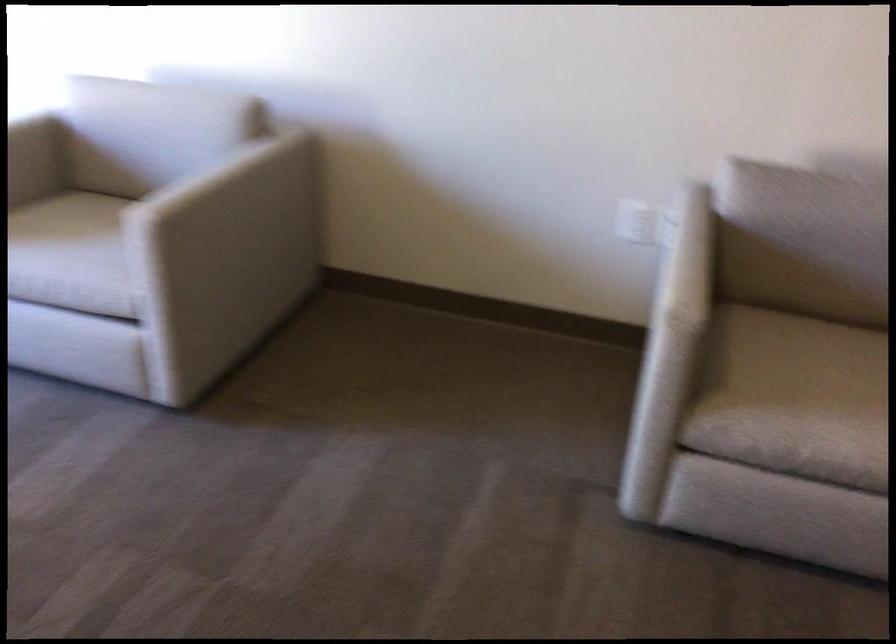
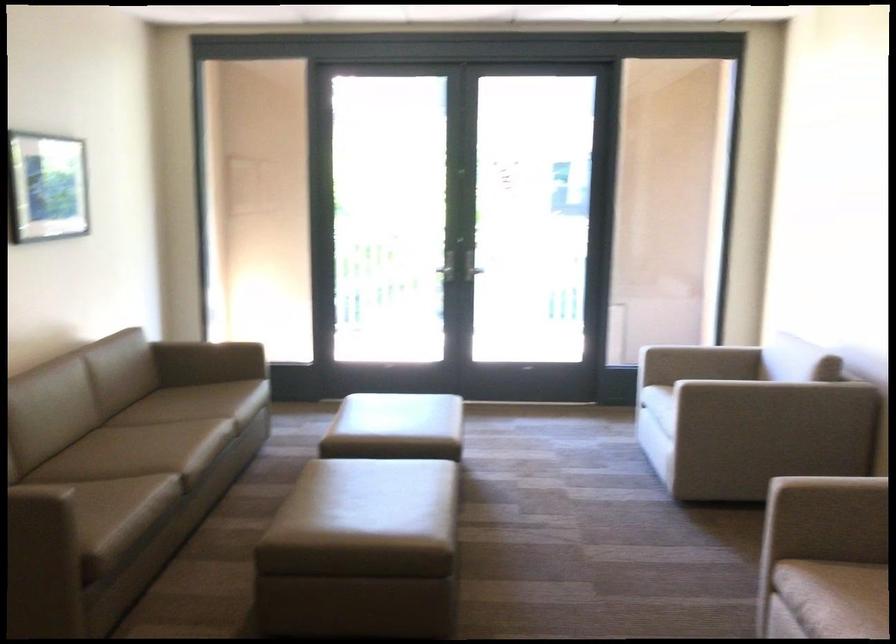
Question: I am providing you with two images of the same scene from different viewpoints. Which of the following objects are not visible in image2?

Choices:
 (A) chair sitting surface
 (B) brown padded ottoman
 (C) beige chair sitting surface
 (D) pink air hockey mallet

Answer: (A)